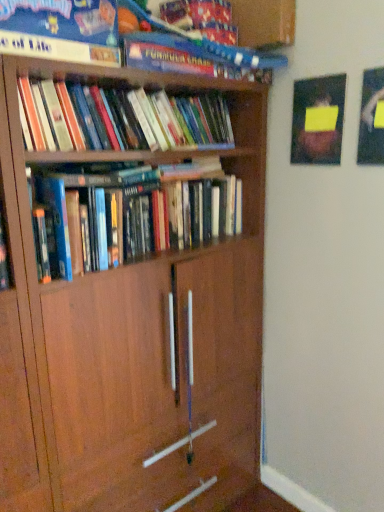
Locate an element on the screen. This screenshot has width=384, height=512. hardcover books at upper left, the second book in the bottom-to-top sequence is located at coordinates (122, 119).

Consider the image. Measure the distance between hardcover books at upper left, the second book in the bottom-to-top sequence, and camera.

hardcover books at upper left, the second book in the bottom-to-top sequence, and camera are 1.12 meters apart.

This screenshot has height=512, width=384. I want to click on hardcover books at center, which ranks as the first book in bottom-to-top order, so click(139, 212).

Measure the distance between point (13, 46) and camera.

Point (13, 46) and camera are 1.02 meters apart.

You are a GUI agent. You are given a task and a screenshot of the screen. Output one action in this format:
    pyautogui.click(x=<x>, y=<y>)
    Task: Click on the hardcover books at upper left, the second book in the bottom-to-top sequence
    
    Given the screenshot: What is the action you would take?
    (122, 119)

Is hardcover books at upper left, the second book in the bottom-to-top sequence, located within hardcover books at center, which ranks as the first book in bottom-to-top order?

No.

Between hardcover books at center, which is the third book in top-to-bottom order, and hardcover books at upper left, the second book in the bottom-to-top sequence, which one appears on the right side from the viewer's perspective?

From the viewer's perspective, hardcover books at center, which is the third book in top-to-bottom order, appears more on the right side.

From a real-world perspective, which is physically below, hardcover books at center, which is the third book in top-to-bottom order, or hardcover books at upper left, the second book in the bottom-to-top sequence?

In real-world perspective, hardcover books at center, which is the third book in top-to-bottom order, is lower.

Considering the sizes of hardcover books at center, which is the third book in top-to-bottom order, and hardcover books at upper left, which is counted as the second book, starting from the top, in the image, is hardcover books at center, which is the third book in top-to-bottom order, taller or shorter than hardcover books at upper left, which is counted as the second book, starting from the top,?

hardcover books at center, which is the third book in top-to-bottom order, is taller than hardcover books at upper left, which is counted as the second book, starting from the top.

Find the location of a particular element. Image resolution: width=384 pixels, height=512 pixels. book that is the 2nd object above the hardcover books at center, which ranks as the first book in bottom-to-top order (from a real-world perspective) is located at coordinates (195, 56).

Between hardcover book at upper center, which is the 1th book in top-to-bottom order, and hardcover books at center, which ranks as the first book in bottom-to-top order, which one has more height?

hardcover books at center, which ranks as the first book in bottom-to-top order.

Does hardcover book at upper center, which is the 1th book in top-to-bottom order, touch hardcover books at center, which ranks as the first book in bottom-to-top order?

No, hardcover book at upper center, which is the 1th book in top-to-bottom order, is not making contact with hardcover books at center, which ranks as the first book in bottom-to-top order.

Between point (99, 49) and point (89, 233), which one is positioned in front?

The point (99, 49) is more forward.

Is hardcover books at center, which ranks as the first book in bottom-to-top order, directly adjacent to hardcover book at upper center, which is the 1th book in top-to-bottom order?

No, hardcover books at center, which ranks as the first book in bottom-to-top order, is not next to hardcover book at upper center, which is the 1th book in top-to-bottom order.

Where is `the 2nd book behind the hardcover book at upper center, which is the 1th book in top-to-bottom order, counting from the anchor's position`? The height and width of the screenshot is (512, 384). the 2nd book behind the hardcover book at upper center, which is the 1th book in top-to-bottom order, counting from the anchor's position is located at coordinates (139, 212).

Considering the positions of objects hardcover books at center, which ranks as the first book in bottom-to-top order, and hardcover book at upper center, the third book in the bottom-to-top sequence, in the image provided, who is more to the left, hardcover books at center, which ranks as the first book in bottom-to-top order, or hardcover book at upper center, the third book in the bottom-to-top sequence,?

hardcover book at upper center, the third book in the bottom-to-top sequence.

Does hardcover books at center, which is the third book in top-to-bottom order, lie in front of hardcover book at upper center, the third book in the bottom-to-top sequence?

That is False.

From the image's perspective, is hardcover book at upper center, the third book in the bottom-to-top sequence, located above hardcover books at upper left, the second book in the bottom-to-top sequence?

Correct, hardcover book at upper center, the third book in the bottom-to-top sequence, appears higher than hardcover books at upper left, the second book in the bottom-to-top sequence, in the image.

Which is closer to the camera, (243, 66) or (24, 115)?

The point (24, 115) is more forward.

Is hardcover books at upper left, which is counted as the second book, starting from the top, at the back of hardcover book at upper center, the third book in the bottom-to-top sequence?

No.

Who is shorter, hardcover book at upper center, the third book in the bottom-to-top sequence, or hardcover books at upper left, which is counted as the second book, starting from the top?

With less height is hardcover books at upper left, which is counted as the second book, starting from the top.

Is point (53, 109) positioned in front of point (165, 234)?

Yes, it is.

Could you tell me if hardcover books at upper left, which is counted as the second book, starting from the top, is turned towards hardcover books at center, which ranks as the first book in bottom-to-top order?

No.

Is hardcover books at upper left, which is counted as the second book, starting from the top, taller or shorter than hardcover books at center, which ranks as the first book in bottom-to-top order?

Clearly, hardcover books at upper left, which is counted as the second book, starting from the top, is shorter compared to hardcover books at center, which ranks as the first book in bottom-to-top order.

Is hardcover books at upper left, which is counted as the second book, starting from the top, at the right side of hardcover book at upper center, the third book in the bottom-to-top sequence?

Incorrect, hardcover books at upper left, which is counted as the second book, starting from the top, is not on the right side of hardcover book at upper center, the third book in the bottom-to-top sequence.

Could you tell me if hardcover books at upper left, which is counted as the second book, starting from the top, is facing hardcover book at upper center, which is the 1th book in top-to-bottom order?

No, hardcover books at upper left, which is counted as the second book, starting from the top, is not turned towards hardcover book at upper center, which is the 1th book in top-to-bottom order.

Is hardcover books at upper left, which is counted as the second book, starting from the top, taller or shorter than hardcover book at upper center, which is the 1th book in top-to-bottom order?

Clearly, hardcover books at upper left, which is counted as the second book, starting from the top, is shorter compared to hardcover book at upper center, which is the 1th book in top-to-bottom order.

Find the location of a particular element. This screenshot has width=384, height=512. book in front of the hardcover books at upper left, the second book in the bottom-to-top sequence is located at coordinates (195, 56).

The image size is (384, 512). I want to click on book that is the 1st one when counting forward from the hardcover books at center, which ranks as the first book in bottom-to-top order, so click(x=122, y=119).

The height and width of the screenshot is (512, 384). Find the location of `book that appears on the right of hardcover book at upper center, the third book in the bottom-to-top sequence`. book that appears on the right of hardcover book at upper center, the third book in the bottom-to-top sequence is located at coordinates (139, 212).

When comparing their distances from hardcover book at upper center, which is the 1th book in top-to-bottom order, does hardcover books at upper left, which is counted as the second book, starting from the top, or hardcover books at center, which ranks as the first book in bottom-to-top order, seem further?

Based on the image, hardcover books at center, which ranks as the first book in bottom-to-top order, appears to be further to hardcover book at upper center, which is the 1th book in top-to-bottom order.

When comparing their distances from hardcover book at upper center, the third book in the bottom-to-top sequence, does hardcover books at center, which is the third book in top-to-bottom order, or hardcover books at upper left, which is counted as the second book, starting from the top, seem further?

hardcover books at center, which is the third book in top-to-bottom order, lies further to hardcover book at upper center, the third book in the bottom-to-top sequence, than the other object.

When comparing their distances from hardcover books at center, which is the third book in top-to-bottom order, does hardcover books at upper left, which is counted as the second book, starting from the top, or hardcover book at upper center, the third book in the bottom-to-top sequence, seem further?

hardcover book at upper center, the third book in the bottom-to-top sequence, is positioned further to the anchor hardcover books at center, which is the third book in top-to-bottom order.

Considering their positions, is hardcover book at upper center, the third book in the bottom-to-top sequence, positioned closer to hardcover books at upper left, which is counted as the second book, starting from the top, than hardcover books at center, which is the third book in top-to-bottom order?

hardcover book at upper center, the third book in the bottom-to-top sequence, is closer to hardcover books at upper left, which is counted as the second book, starting from the top.

Based on their spatial positions, is hardcover book at upper center, the third book in the bottom-to-top sequence, or hardcover books at upper left, the second book in the bottom-to-top sequence, further from hardcover books at center, which is the third book in top-to-bottom order?

Among the two, hardcover book at upper center, the third book in the bottom-to-top sequence, is located further to hardcover books at center, which is the third book in top-to-bottom order.

From the image, which object appears to be farther from hardcover books at upper left, which is counted as the second book, starting from the top, hardcover books at center, which is the third book in top-to-bottom order, or hardcover book at upper center, which is the 1th book in top-to-bottom order?

The object further to hardcover books at upper left, which is counted as the second book, starting from the top, is hardcover books at center, which is the third book in top-to-bottom order.

The width and height of the screenshot is (384, 512). I want to click on book between hardcover book at upper center, the third book in the bottom-to-top sequence, and hardcover books at center, which ranks as the first book in bottom-to-top order, from top to bottom, so click(x=122, y=119).